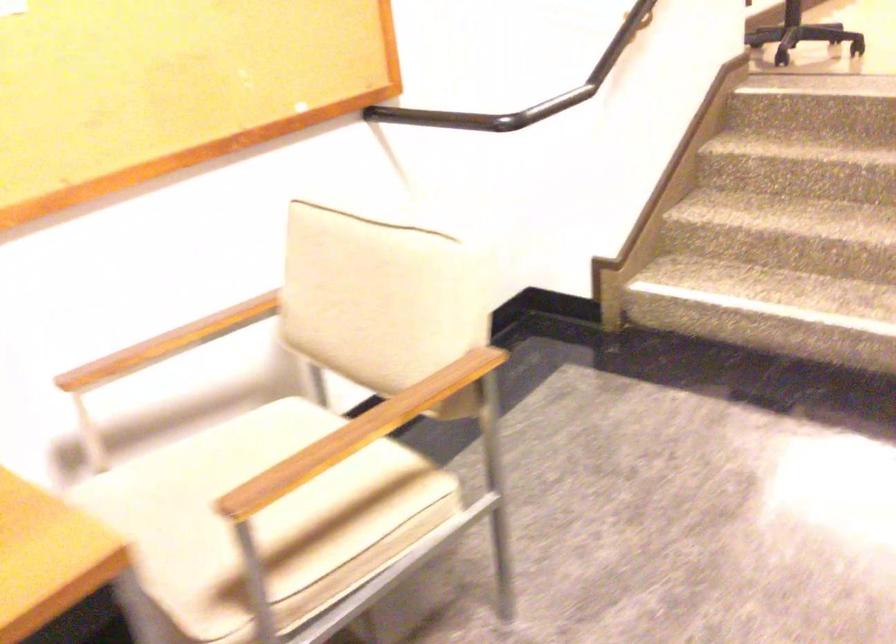
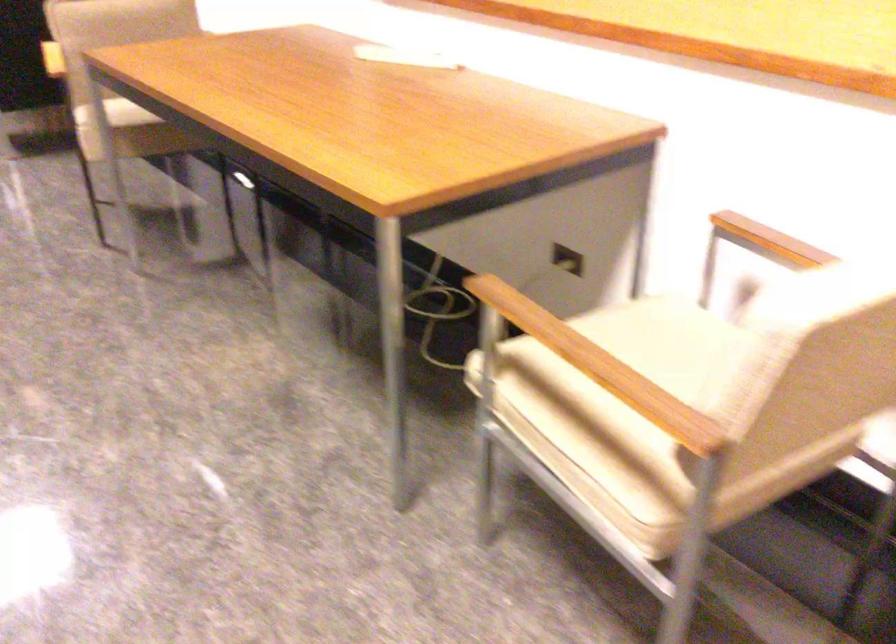
Locate, in the second image, the point that corresponds to pixel 416 404 in the first image.

(599, 366)